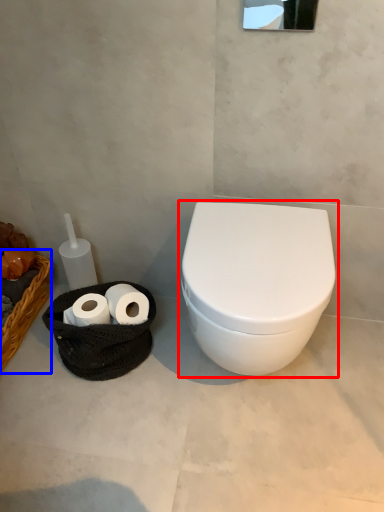
Question: Which object appears closest to the camera in this image, toilet (highlighted by a red box) or basket (highlighted by a blue box)?

Choices:
 (A) toilet
 (B) basket

Answer: (A)